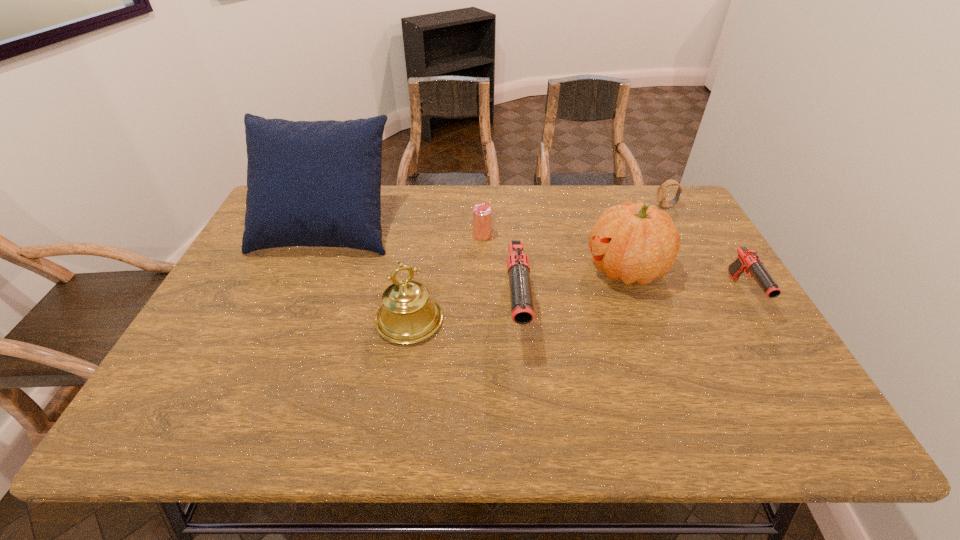
Find the location of a particular element. The image size is (960, 540). the left gun is located at coordinates (522, 309).

You are a GUI agent. You are given a task and a screenshot of the screen. Output one action in this format:
    pyautogui.click(x=<x>, y=<y>)
    Task: Click on the taller gun
    
    Given the screenshot: What is the action you would take?
    pyautogui.click(x=522, y=309)

Where is `the right gun`? the right gun is located at coordinates (748, 260).

Locate an element on the screen. The image size is (960, 540). the rightmost object is located at coordinates (748, 260).

Locate an element on the screen. This screenshot has width=960, height=540. the leftmost object is located at coordinates (310, 183).

This screenshot has height=540, width=960. I want to click on cushion, so click(x=310, y=183).

This screenshot has height=540, width=960. Find the location of `the second object from right to left`. the second object from right to left is located at coordinates (662, 190).

Image resolution: width=960 pixels, height=540 pixels. I want to click on the fifth object from left to right, so click(x=638, y=242).

This screenshot has height=540, width=960. I want to click on the sixth shortest object, so click(638, 242).

I want to click on the third object from left to right, so click(x=482, y=212).